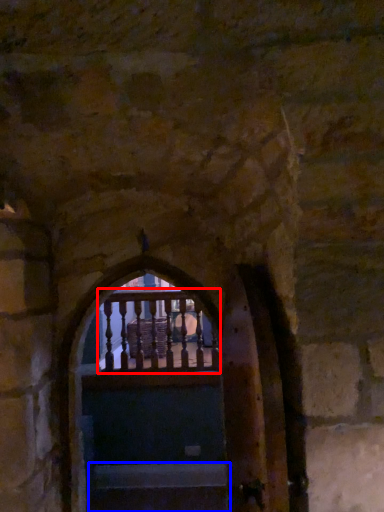
Question: Among these objects, which one is farthest to the camera, balcony (highlighted by a red box) or stairs (highlighted by a blue box)?

Choices:
 (A) balcony
 (B) stairs

Answer: (A)